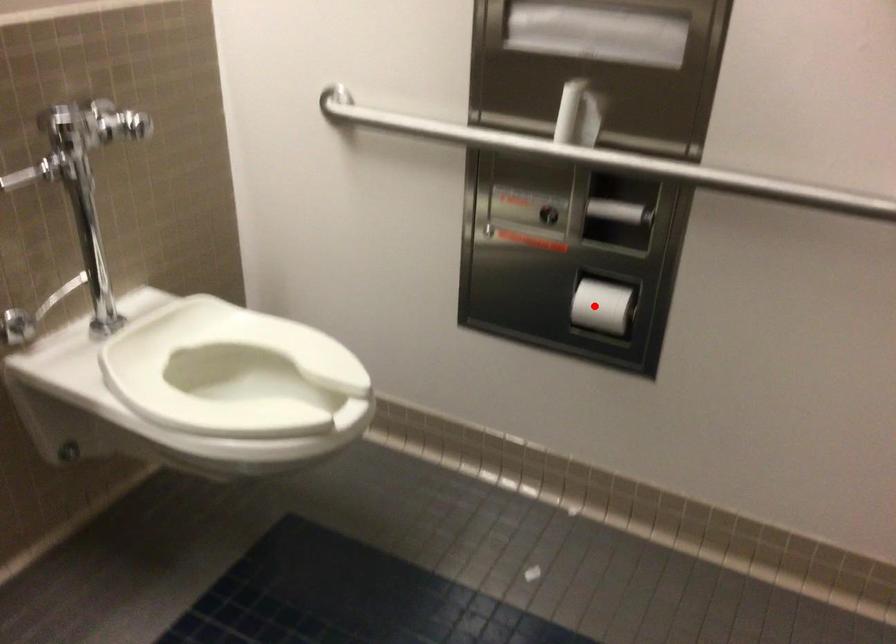
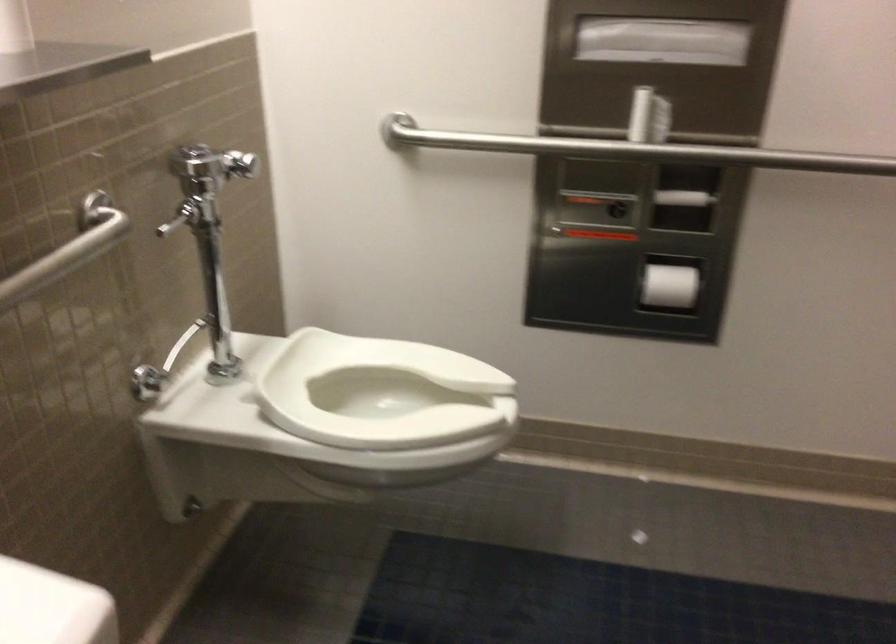
In the second image, find the point that corresponds to the highlighted location in the first image.

(668, 287)